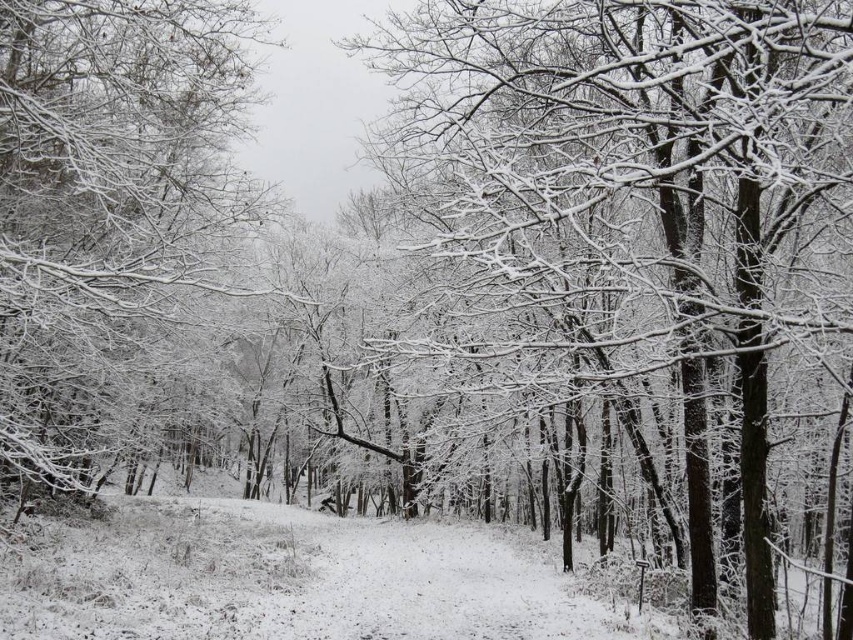
Measure the distance between snow-covered branches at center and white frosty branches at left.

4.89 meters

Where is `snow-covered branches at center`? The width and height of the screenshot is (853, 640). snow-covered branches at center is located at coordinates (639, 193).